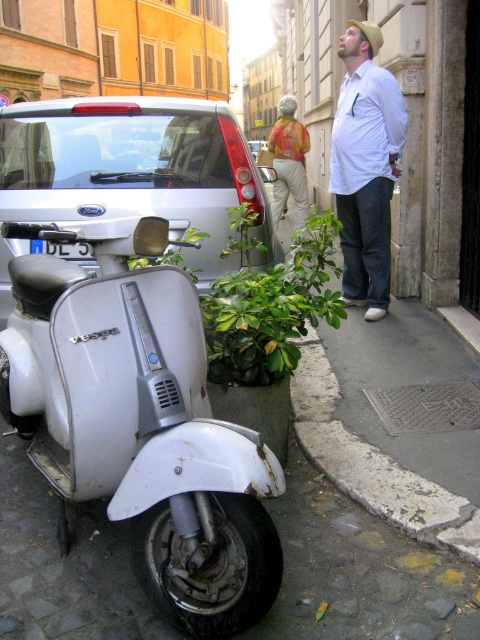
Is silver metallic scooter at left to the right of white cotton shirt at upper center from the viewer's perspective?

Incorrect, silver metallic scooter at left is not on the right side of white cotton shirt at upper center.

Which is behind, point (116, 132) or point (387, 256)?

Point (387, 256)

Locate an element on the screen. This screenshot has height=640, width=480. silver metallic scooter at left is located at coordinates (135, 170).

Which is more to the left, white matte scooter at lower left or silver metallic scooter at left?

silver metallic scooter at left

Who is positioned more to the right, white matte scooter at lower left or silver metallic scooter at left?

From the viewer's perspective, white matte scooter at lower left appears more on the right side.

Which is behind, point (256, 534) or point (203, 154)?

Point (203, 154)

Where is `white matte scooter at lower left`? This screenshot has width=480, height=640. white matte scooter at lower left is located at coordinates (141, 420).

Is white matte scooter at lower left thinner than blue plastic license plate at lower left?

No.

Does white matte scooter at lower left lie in front of blue plastic license plate at lower left?

Yes, white matte scooter at lower left is in front of blue plastic license plate at lower left.

Is point (99, 429) positioned in front of point (59, 248)?

Yes.

You are a GUI agent. You are given a task and a screenshot of the screen. Output one action in this format:
    pyautogui.click(x=<x>, y=<y>)
    Task: Click on the white matte scooter at lower left
    
    Given the screenshot: What is the action you would take?
    pyautogui.click(x=141, y=420)